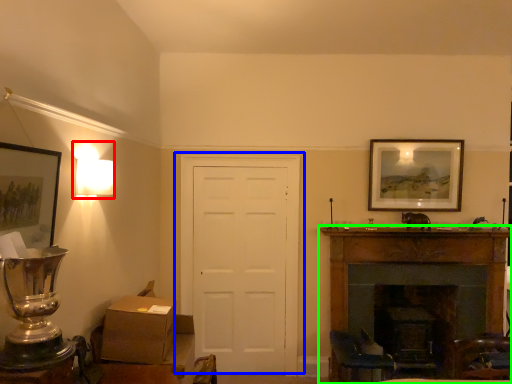
Question: Which object is the closest to the lamp (highlighted by a red box)? Choose among these: door (highlighted by a blue box) or fireplace (highlighted by a green box).

Choices:
 (A) door
 (B) fireplace

Answer: (A)